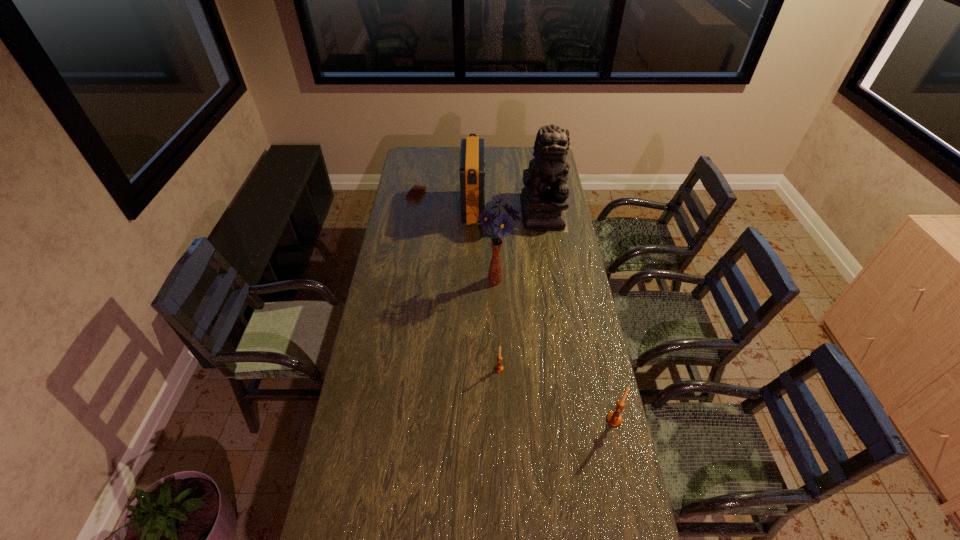
Locate an element on the screen. free space between the third tallest object and the flower arrangement is located at coordinates (484, 245).

Identify the location of vacant space in between the sculpture and the farther candle_holder. (520, 289).

Select which object is the third closest to the radio receiver. Please provide its 2D coordinates. Your answer should be formatted as a tuple, i.e. [(x, y)], where the tuple contains the x and y coordinates of a point satisfying the conditions above.

[(502, 225)]

Locate which object ranks fifth in proximity to the fourth tallest object. Please provide its 2D coordinates. Your answer should be formatted as a tuple, i.e. [(x, y)], where the tuple contains the x and y coordinates of a point satisfying the conditions above.

[(416, 192)]

The width and height of the screenshot is (960, 540). What are the coordinates of `vacant space that satisfies the following two spatial constraints: 1. on the front-facing side of the radio receiver; 2. on the right side of the taller candle_holder` in the screenshot? It's located at (470, 420).

Where is `free point that satisfies the following two spatial constraints: 1. on the front side of the farther candle_holder; 2. on the left side of the third nearest object`? The width and height of the screenshot is (960, 540). free point that satisfies the following two spatial constraints: 1. on the front side of the farther candle_holder; 2. on the left side of the third nearest object is located at coordinates (496, 368).

Find the location of a particular element. vacant position in the image that satisfies the following two spatial constraints: 1. on the front-facing side of the radio receiver; 2. on the left side of the third shortest object is located at coordinates (470, 420).

Find the location of `vacant space that satisfies the following two spatial constraints: 1. on the front-facing side of the right candle_holder; 2. on the right side of the radio receiver`. vacant space that satisfies the following two spatial constraints: 1. on the front-facing side of the right candle_holder; 2. on the right side of the radio receiver is located at coordinates (470, 420).